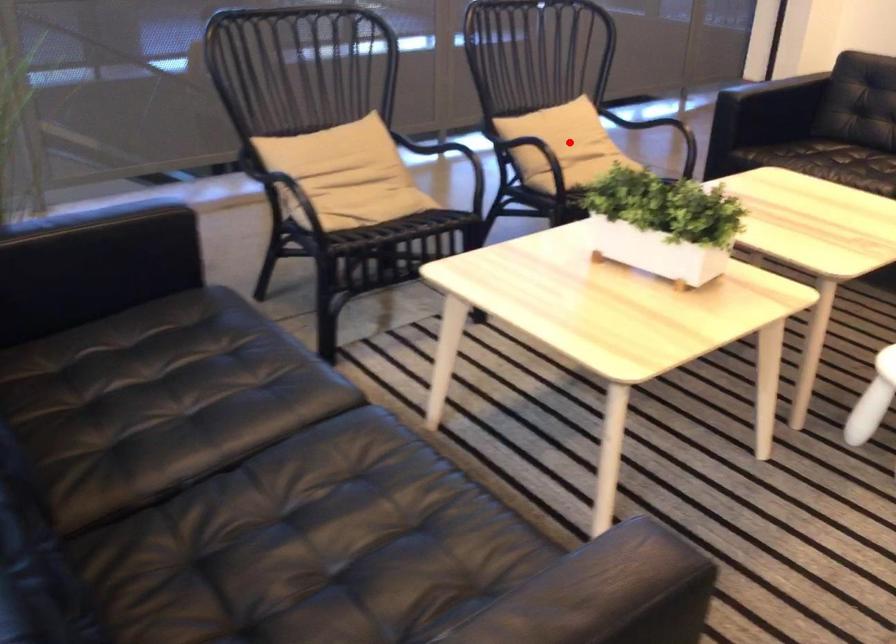
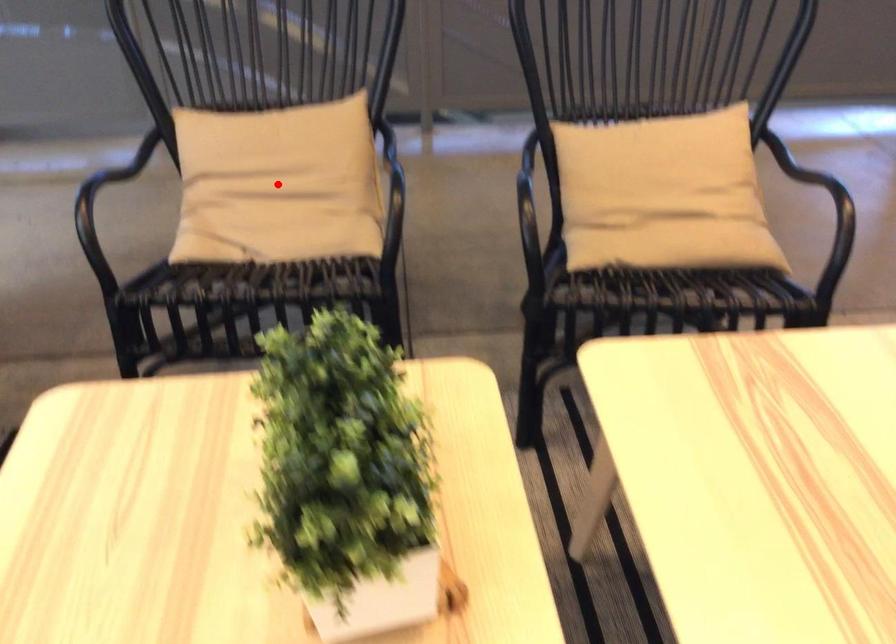
I am providing you with two images of the same scene from different viewpoints. A red point is marked on the first image and another point is marked on the second image. Is the marked point in image1 the same physical position as the marked point in image2?

No